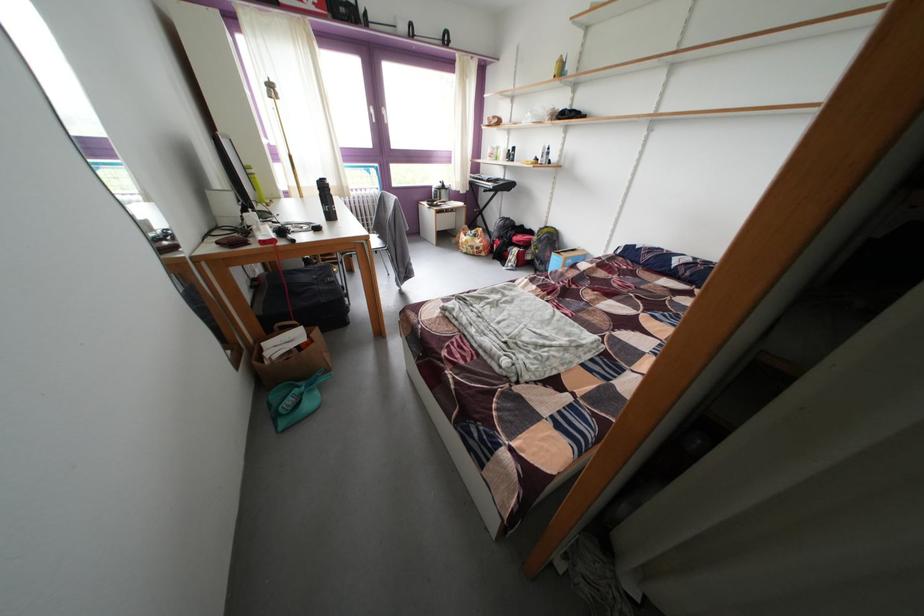
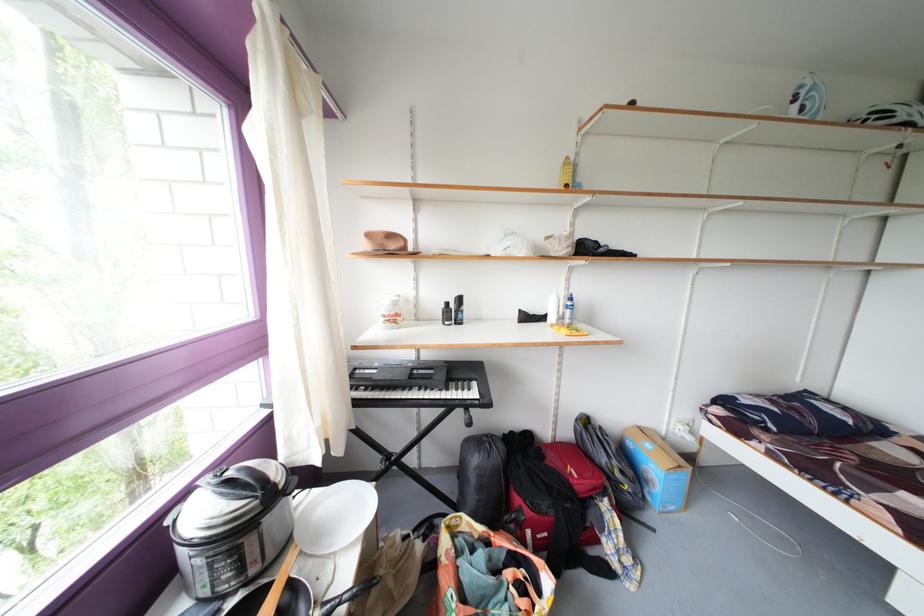
Locate, in the second image, the point that corresponds to (x=492, y=185) in the first image.

(427, 394)